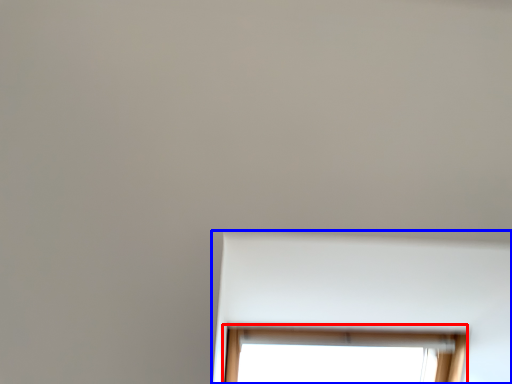
Question: Among these objects, which one is farthest to the camera, window (highlighted by a red box) or bay window (highlighted by a blue box)?

Choices:
 (A) window
 (B) bay window

Answer: (A)